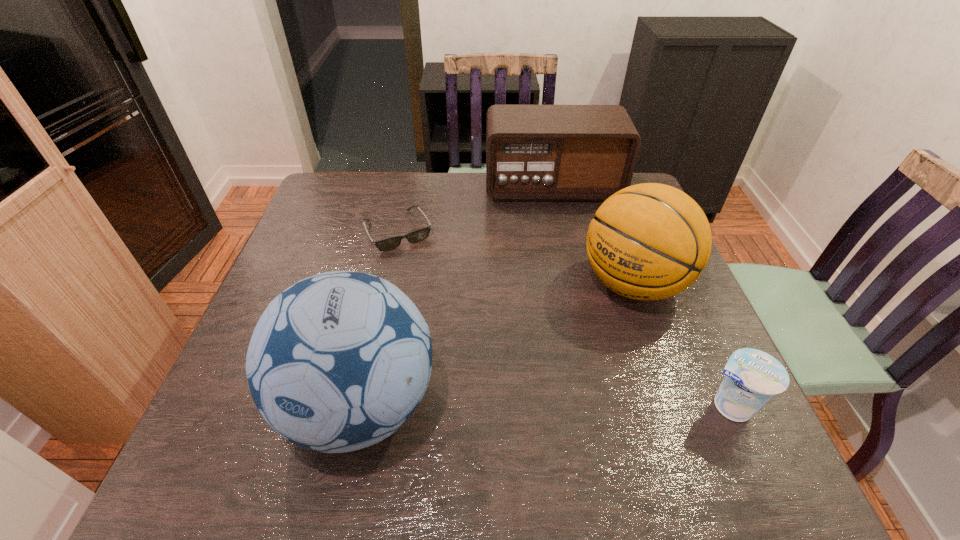
Identify the location of free space located 0.170m on the front-facing side of the shortest object. click(433, 293).

Image resolution: width=960 pixels, height=540 pixels. I want to click on blank space located on the front-facing side of the shortest object, so click(x=449, y=321).

At what (x,y) coordinates should I click in order to perform the action: click on free region located 0.290m on the front-facing side of the shortest object. Please return your answer as a coordinate pair (x, y). The height and width of the screenshot is (540, 960). Looking at the image, I should click on (452, 327).

Where is `vacant space situated 0.180m on the front-facing side of the farthest object`? Image resolution: width=960 pixels, height=540 pixels. vacant space situated 0.180m on the front-facing side of the farthest object is located at coordinates (563, 242).

The image size is (960, 540). Find the location of `vacant point located on the front-facing side of the farthest object`. vacant point located on the front-facing side of the farthest object is located at coordinates (564, 252).

Identify the location of free spot located 0.150m on the front-facing side of the farthest object. Image resolution: width=960 pixels, height=540 pixels. (562, 235).

Where is `sunglasses that is positioned at the far edge`? sunglasses that is positioned at the far edge is located at coordinates (390, 243).

Locate an element on the screen. radio receiver that is at the far edge is located at coordinates (533, 152).

Image resolution: width=960 pixels, height=540 pixels. Identify the location of soccer ball situated at the near edge. (337, 362).

Locate an element on the screen. yogurt that is at the near edge is located at coordinates (752, 377).